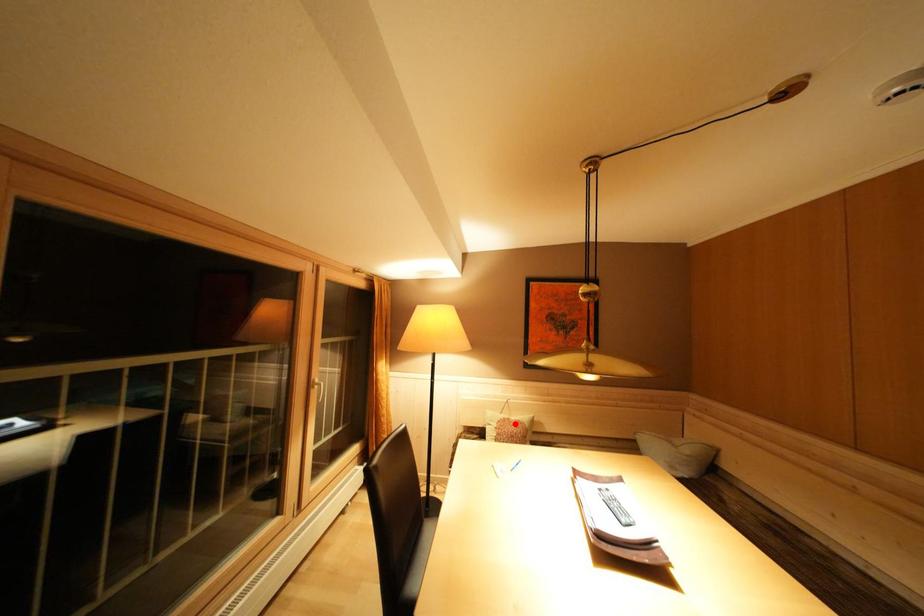
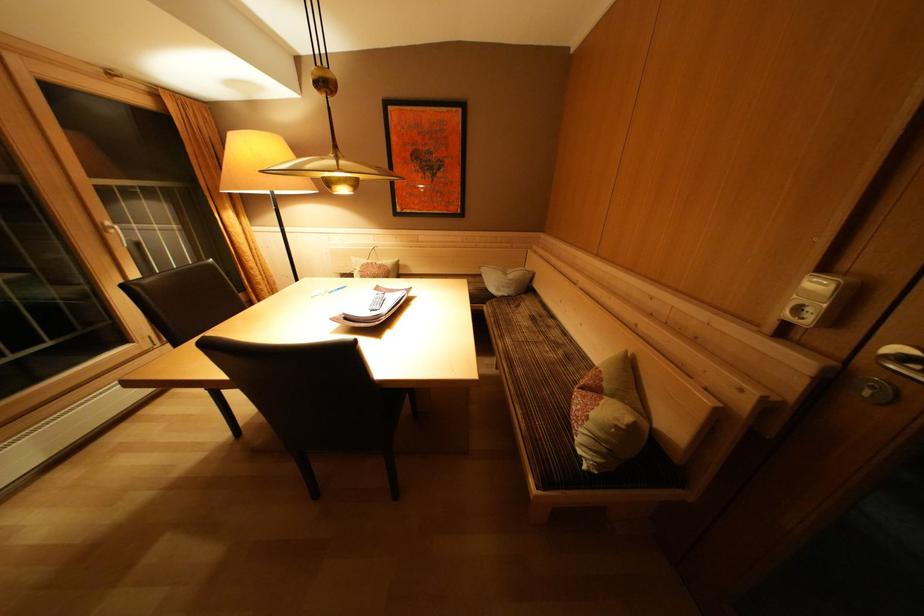
Question: I am providing you with two images of the same scene from different viewpoints. Given a red point in image1, look at the same physical point in image2. Is it:

Choices:
 (A) Closer to the viewpoint
 (B) Farther from the viewpoint

Answer: (A)